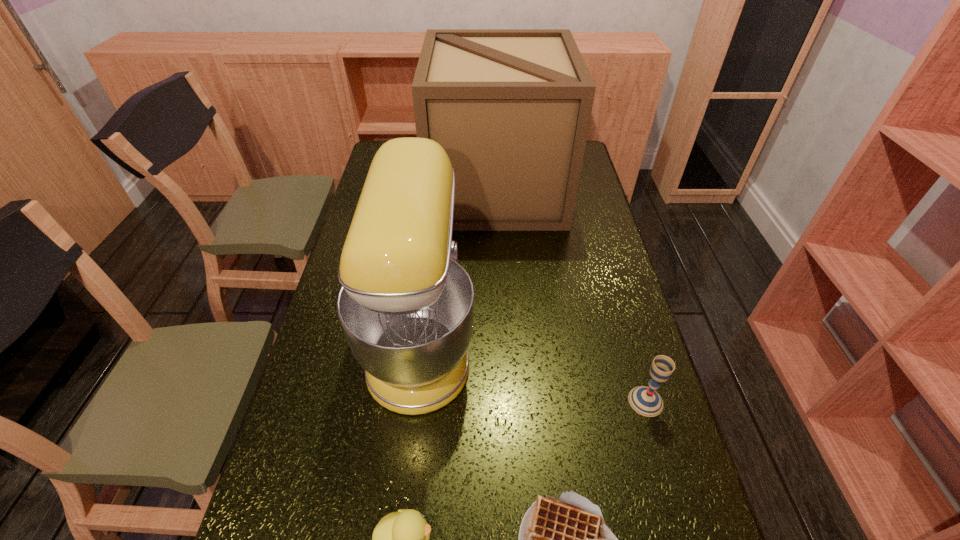
I want to click on object located at the left edge, so click(x=406, y=306).

You are a GUI agent. You are given a task and a screenshot of the screen. Output one action in this format:
    pyautogui.click(x=<x>, y=<y>)
    Task: Click on the box situated at the right edge
    
    Given the screenshot: What is the action you would take?
    pyautogui.click(x=511, y=108)

The image size is (960, 540). I want to click on chalice located in the right edge section of the desktop, so click(x=646, y=401).

The image size is (960, 540). Identify the location of object situated at the far right corner. (511, 108).

In the image, there is a desktop. At what (x,y) coordinates should I click in order to perform the action: click on vacant space at the left edge. Please return your answer as a coordinate pair (x, y). Looking at the image, I should click on (312, 369).

Where is `vacant space at the right edge of the desktop`? vacant space at the right edge of the desktop is located at coordinates (606, 237).

Locate an element on the screen. The width and height of the screenshot is (960, 540). vacant area that lies between the mixer and the farthest object is located at coordinates (459, 264).

At what (x,y) coordinates should I click in order to perform the action: click on empty location between the farthest object and the mixer. Please return your answer as a coordinate pair (x, y). Looking at the image, I should click on (459, 264).

You are a GUI agent. You are given a task and a screenshot of the screen. Output one action in this format:
    pyautogui.click(x=<x>, y=<y>)
    Task: Click on the free space between the box and the mixer
    
    Given the screenshot: What is the action you would take?
    pyautogui.click(x=459, y=264)

The width and height of the screenshot is (960, 540). Find the location of `object that can be found as the closest to the shortest object`. object that can be found as the closest to the shortest object is located at coordinates (401, 539).